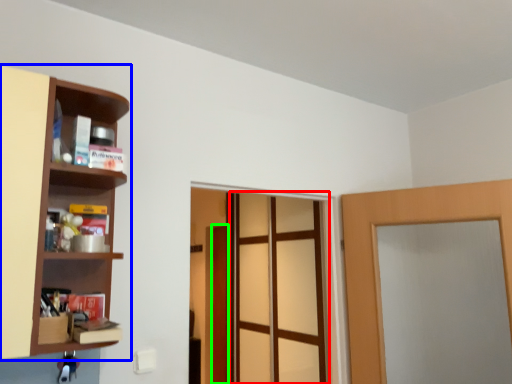
Question: Based on their relative distances, which object is farther from screen door (highlighted by a red box)? Choose from shelf (highlighted by a blue box) and door (highlighted by a green box).

Choices:
 (A) shelf
 (B) door

Answer: (A)